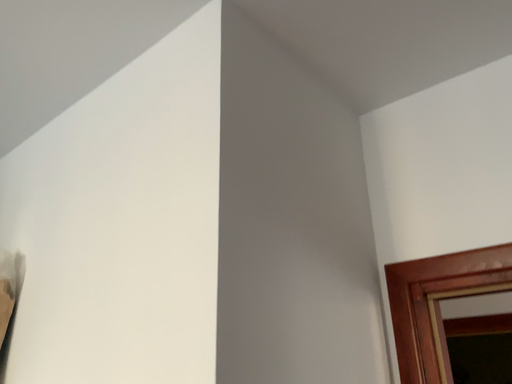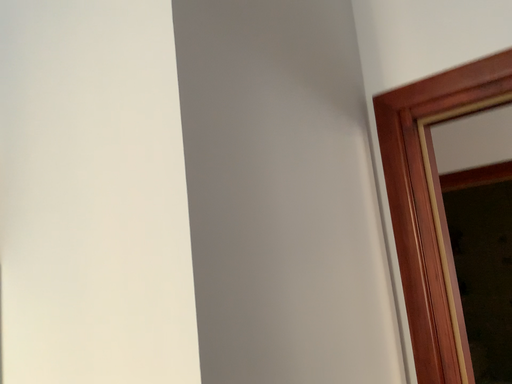
Question: How did the camera likely rotate when shooting the video?

Choices:
 (A) rotated downward
 (B) rotated upward

Answer: (A)